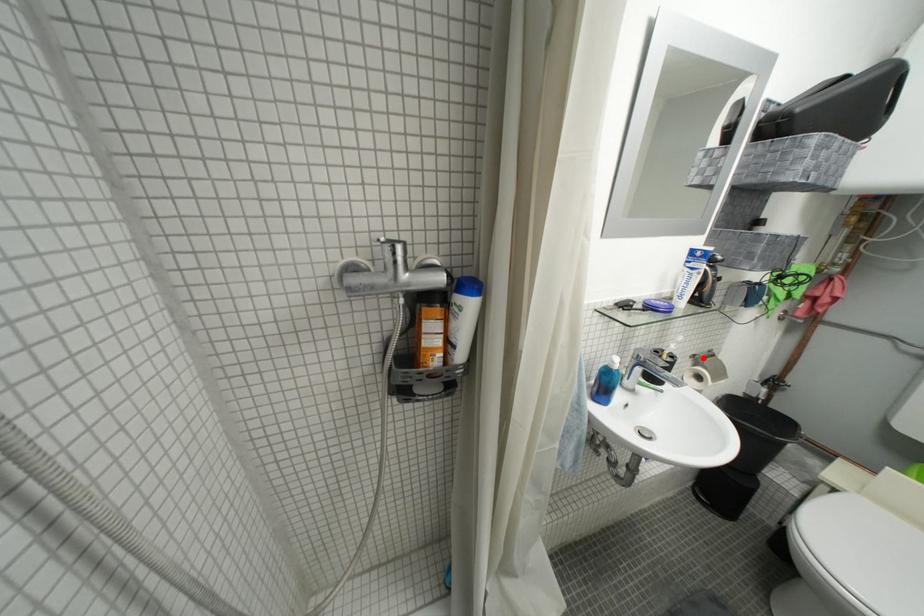
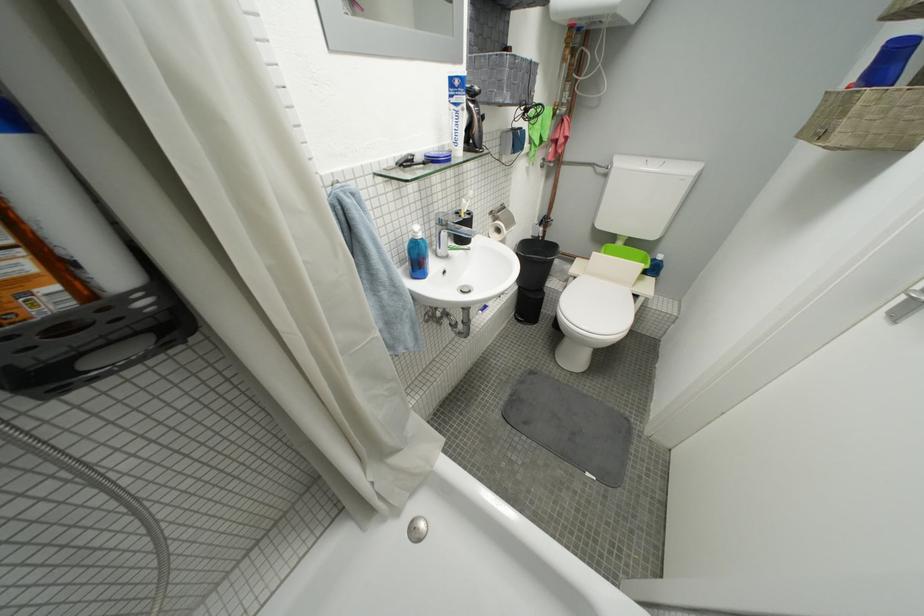
Locate, in the second image, the point that corresponds to the highlighted location in the first image.

(500, 214)